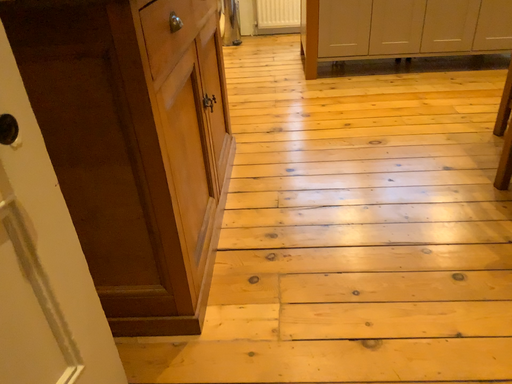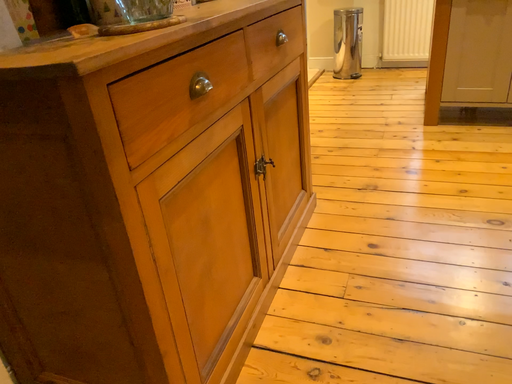
Question: How did the camera likely rotate when shooting the video?

Choices:
 (A) rotated left
 (B) rotated right

Answer: (A)